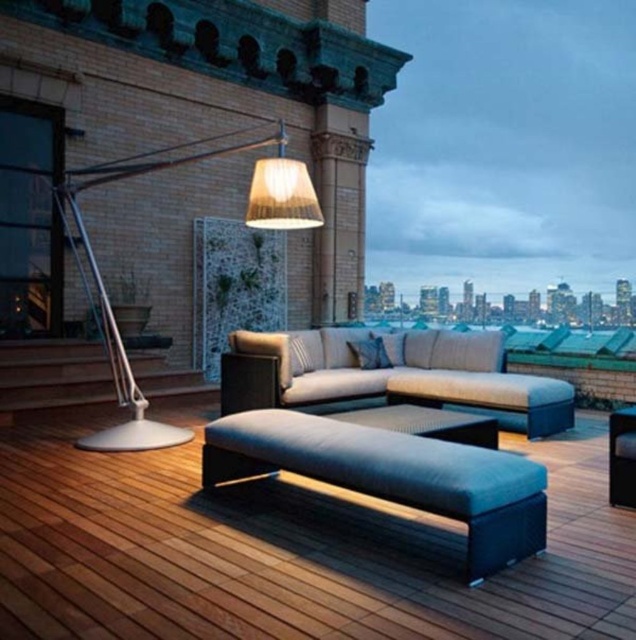
You are standing at point [282,193] and want to walk towards the city skyline view. Which direction should you move relative to point [80,538]?

You should move towards point [80,538] because it is in front of point [282,193], meaning it is closer to the city skyline view.

You are planning to place a rectangular coffee table between the velvet dark blue bench at center and the textured beige couch at center. Considering their widths, which side of the table should be closer to the thinner object to ensure stability?

The velvet dark blue bench at center is thinner than the textured beige couch at center, so the narrower side of the coffee table should be positioned closer to the velvet dark blue bench at center for better stability.

You are planning to rearrange the furniture in the outdoor patio. If you want to place the metallic silver floor lamp at upper left closer to the city view, would its smaller size allow it to fit in the space between the textured beige couch at center and the edge of the patio?

The metallic silver floor lamp at upper left has a smaller size compared to the textured beige couch at center, so it should fit in the space between the couch and the edge of the patio without issue.